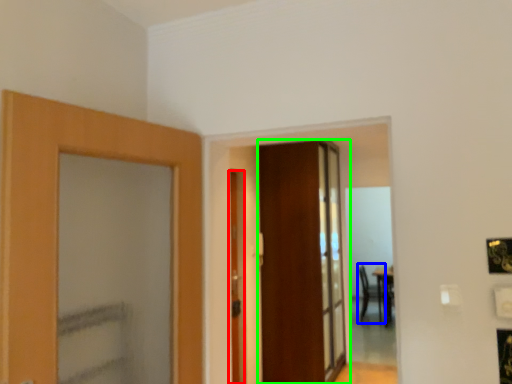
Question: Based on their relative distances, which object is farther from door (highlighted by a red box)? Choose from armchair (highlighted by a blue box) and door (highlighted by a green box).

Choices:
 (A) armchair
 (B) door

Answer: (A)